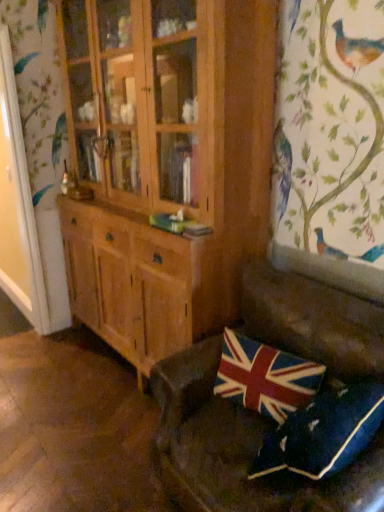
Question: Is leather couch at lower right touching union jack fabric pillow at lower right, which appears as the first pillow when viewed from the back?

Choices:
 (A) no
 (B) yes

Answer: (A)

Question: From the image's perspective, does leather couch at lower right appear lower than union jack fabric pillow at lower right, which appears as the first pillow when viewed from the back?

Choices:
 (A) yes
 (B) no

Answer: (A)

Question: From the image's perspective, would you say leather couch at lower right is positioned over union jack fabric pillow at lower right, the 2th pillow positioned from the front?

Choices:
 (A) no
 (B) yes

Answer: (A)

Question: Is leather couch at lower right taller than union jack fabric pillow at lower right, the 2th pillow positioned from the front?

Choices:
 (A) no
 (B) yes

Answer: (B)

Question: Is leather couch at lower right smaller than union jack fabric pillow at lower right, which appears as the first pillow when viewed from the back?

Choices:
 (A) no
 (B) yes

Answer: (A)

Question: In terms of height, does velvet union jack pillow at lower right, which appears as the first pillow when viewed from the front, look taller or shorter compared to leather couch at lower right?

Choices:
 (A) short
 (B) tall

Answer: (A)

Question: Which is correct: velvet union jack pillow at lower right, which appears as the first pillow when viewed from the front, is inside leather couch at lower right, or outside of it?

Choices:
 (A) inside
 (B) outside

Answer: (A)

Question: Is point (259, 448) closer or farther from the camera than point (327, 353)?

Choices:
 (A) closer
 (B) farther

Answer: (A)

Question: Is velvet union jack pillow at lower right, which appears as the first pillow when viewed from the front, in front of or behind leather couch at lower right in the image?

Choices:
 (A) behind
 (B) front

Answer: (A)

Question: From the image's perspective, is leather couch at lower right above or below velvet union jack pillow at lower right, the second pillow when ordered from back to front?

Choices:
 (A) above
 (B) below

Answer: (A)

Question: Is leather couch at lower right spatially inside velvet union jack pillow at lower right, the second pillow when ordered from back to front, or outside of it?

Choices:
 (A) outside
 (B) inside

Answer: (A)

Question: Does point (296, 490) appear closer or farther from the camera than point (369, 407)?

Choices:
 (A) farther
 (B) closer

Answer: (A)

Question: Is leather couch at lower right taller or shorter than velvet union jack pillow at lower right, the second pillow when ordered from back to front?

Choices:
 (A) short
 (B) tall

Answer: (B)

Question: Is union jack fabric pillow at lower right, the 2th pillow positioned from the front, inside the boundaries of velvet union jack pillow at lower right, which appears as the first pillow when viewed from the front, or outside?

Choices:
 (A) outside
 (B) inside

Answer: (A)

Question: Considering their positions, is union jack fabric pillow at lower right, the 2th pillow positioned from the front, located in front of or behind velvet union jack pillow at lower right, the second pillow when ordered from back to front?

Choices:
 (A) front
 (B) behind

Answer: (B)